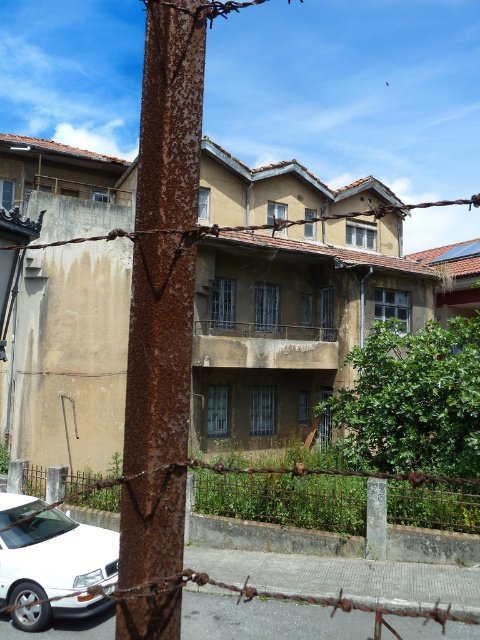
You are a painter who needs to assess the coverage area for painting the rusty metal fence at center and the rusty wire at upper center. Which object requires more paint based on their size?

The rusty wire at upper center requires more paint because it occupies more space than the rusty metal fence at center.

You are driving a car that is exactly 15 feet long. You see the white matte car at lower left and the rusty wire at upper center. Can your car fit between them without touching either?

The distance between the white matte car at lower left and the rusty wire at upper center is 20.34 feet. Since your car is 15 feet long, it can fit between them with approximately 5.34 feet of space remaining.